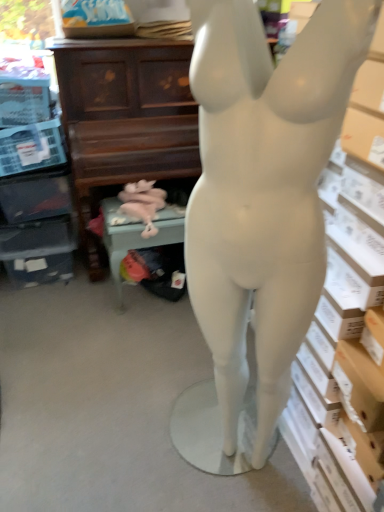
Question: Is pink fabric stuffed animal at lower center in front of or behind green fabric chair at lower center in the image?

Choices:
 (A) front
 (B) behind

Answer: (A)

Question: From the image's perspective, is pink fabric stuffed animal at lower center above or below green fabric chair at lower center?

Choices:
 (A) below
 (B) above

Answer: (B)

Question: Which object is the farthest from the matte brown piano at upper center?

Choices:
 (A) matte white mannequin at center
 (B) green fabric chair at lower center
 (C) pink fabric stuffed animal at lower center

Answer: (A)

Question: Which object is positioned closest to the matte white mannequin at center?

Choices:
 (A) matte brown piano at upper center
 (B) green fabric chair at lower center
 (C) pink fabric stuffed animal at lower center

Answer: (B)